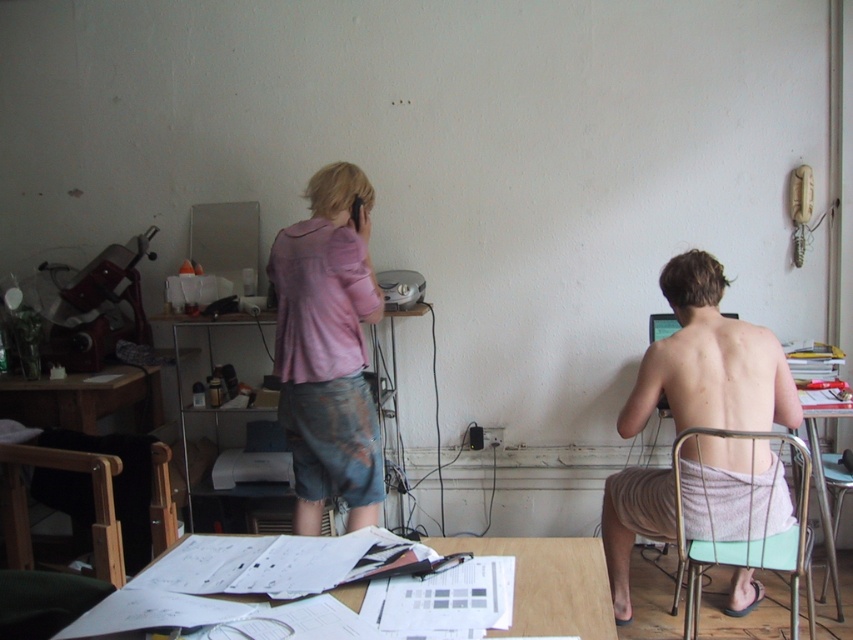
You are organizing a small party in this room and need to place a decorative vase between the gray towel at right and the green plastic chair at lower right. According to the scene description, where should you position the vase?

The gray towel at right is to the left of the green plastic chair at lower right, so you should place the vase between them, ensuring it is positioned to the right of the gray towel at right and to the left of the green plastic chair at lower right.

You are standing in the room and want to grab the gray towel at right. According to the coordinates provided, where exactly should you look to find it?

The gray towel at right is located at point 0.566 on the x axis and 0.834 on the y axis.

You are organizing a small event and need to place a decorative item that is 3 feet wide between the pink cotton shirt at center and the white paper at center. Will there be enough space?

The pink cotton shirt at center and white paper at center are 3.78 feet apart from each other. Since the decorative item is 3 feet wide, there is enough space to place it between them as 3.78 feet is greater than 3 feet.